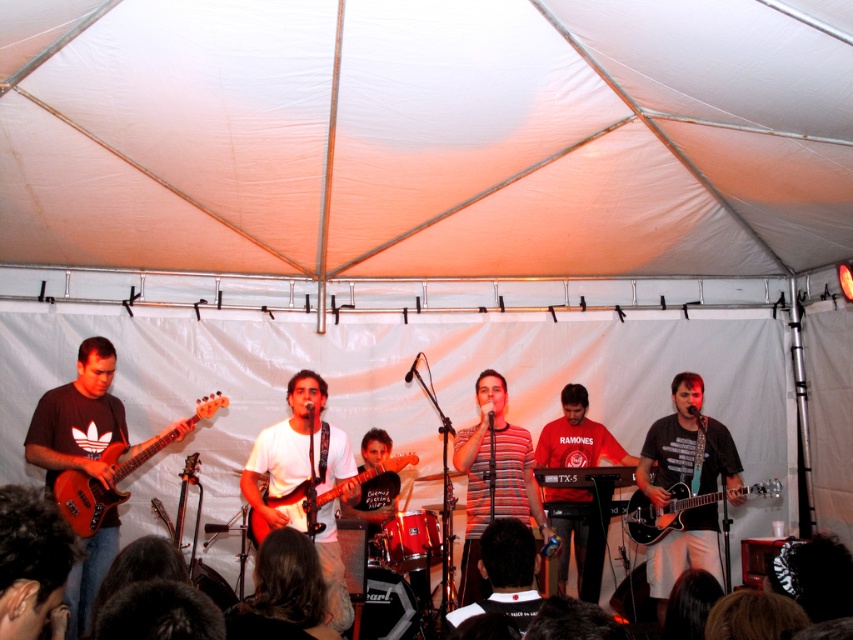
You are a photographer at the live music performance. You need to capture a clear photo of both the matte wood electric guitar at center and the shiny black electric guitar at center. Which guitar should you focus on first to ensure it is in the foreground of your photo?

The matte wood electric guitar at center is above the shiny black electric guitar at center, so focusing on the matte wood electric guitar at center first will place it in the foreground of the photo.

You are a stagehand who needs to move a 5.5 feet long equipment cart between the matte wood electric guitar at center and the shiny black electric guitar at center. Can the cart fit through the space between them?

The distance between the matte wood electric guitar at center and the shiny black electric guitar at center is 6.06 feet. Since the equipment cart is 5.5 feet long, it can fit through the space between them as there is enough clearance.

You are a photographer at the live music performance and want to capture a photo of both the matte black guitar at left and the shiny black electric guitar at center. Which guitar should you position on the left side of your photo to ensure both are in frame?

The matte black guitar at left is already positioned on the left side of the shiny black electric guitar at center, so to capture both in frame, you should keep the matte black guitar at left on the left side of your photo.